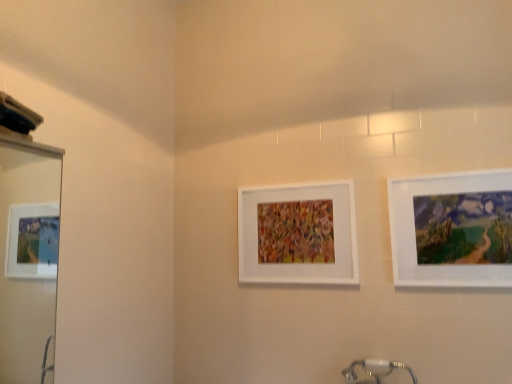
Question: Is matte white picture frame at right, the 2th picture frame from the left, positioned beyond the bounds of white glossy mirror at left?

Choices:
 (A) yes
 (B) no

Answer: (A)

Question: From the image's perspective, is matte white picture frame at right, which is the 1th picture frame from front to back, above white glossy mirror at left?

Choices:
 (A) no
 (B) yes

Answer: (B)

Question: From the image's perspective, is matte white picture frame at right, the second picture frame in the back-to-front sequence, under white glossy mirror at left?

Choices:
 (A) no
 (B) yes

Answer: (A)

Question: Is matte white picture frame at right, which is the 1th picture frame in right-to-left order, thinner than white glossy mirror at left?

Choices:
 (A) no
 (B) yes

Answer: (B)

Question: Considering the relative positions of matte white picture frame at right, the 2th picture frame from the left, and white glossy mirror at left in the image provided, is matte white picture frame at right, the 2th picture frame from the left, to the right of white glossy mirror at left from the viewer's perspective?

Choices:
 (A) no
 (B) yes

Answer: (B)

Question: Considering the relative sizes of matte white picture frame at right, the 2th picture frame from the left, and white glossy mirror at left in the image provided, is matte white picture frame at right, the 2th picture frame from the left, bigger than white glossy mirror at left?

Choices:
 (A) no
 (B) yes

Answer: (A)

Question: Is the position of white matte picture frame at center, the 1th picture frame positioned from the back, more distant than that of matte white picture frame at right, which is the 1th picture frame from front to back?

Choices:
 (A) yes
 (B) no

Answer: (A)

Question: Does white matte picture frame at center, the 2th picture frame from the right, have a lesser width compared to matte white picture frame at right, which is the 1th picture frame in right-to-left order?

Choices:
 (A) no
 (B) yes

Answer: (B)

Question: From a real-world perspective, is white matte picture frame at center, which is counted as the first picture frame, starting from the left, located higher than matte white picture frame at right, which is the 1th picture frame from front to back?

Choices:
 (A) no
 (B) yes

Answer: (B)

Question: From the image's perspective, is white matte picture frame at center, the 1th picture frame positioned from the back, beneath matte white picture frame at right, which is the 1th picture frame from front to back?

Choices:
 (A) no
 (B) yes

Answer: (B)

Question: Is white matte picture frame at center, the 2th picture frame from the right, positioned with its back to matte white picture frame at right, the 2th picture frame from the left?

Choices:
 (A) no
 (B) yes

Answer: (A)

Question: Considering the relative sizes of white matte picture frame at center, which is counted as the first picture frame, starting from the left, and matte white picture frame at right, which is the 1th picture frame in right-to-left order, in the image provided, is white matte picture frame at center, which is counted as the first picture frame, starting from the left, shorter than matte white picture frame at right, which is the 1th picture frame in right-to-left order,?

Choices:
 (A) no
 (B) yes

Answer: (B)

Question: Considering the relative sizes of matte white picture frame at right, which is the 1th picture frame from front to back, and white matte picture frame at center, the 1th picture frame positioned from the back, in the image provided, is matte white picture frame at right, which is the 1th picture frame from front to back, bigger than white matte picture frame at center, the 1th picture frame positioned from the back,?

Choices:
 (A) no
 (B) yes

Answer: (A)